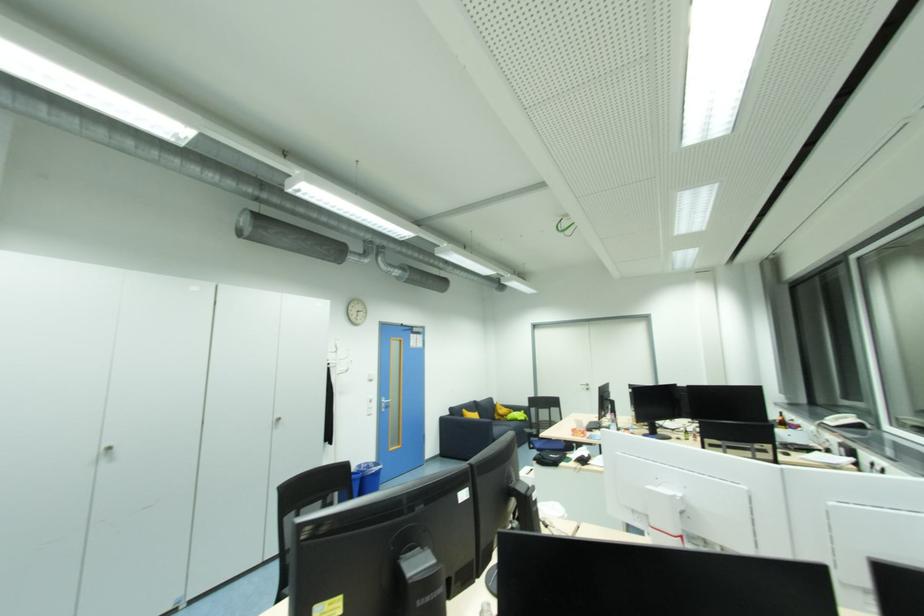
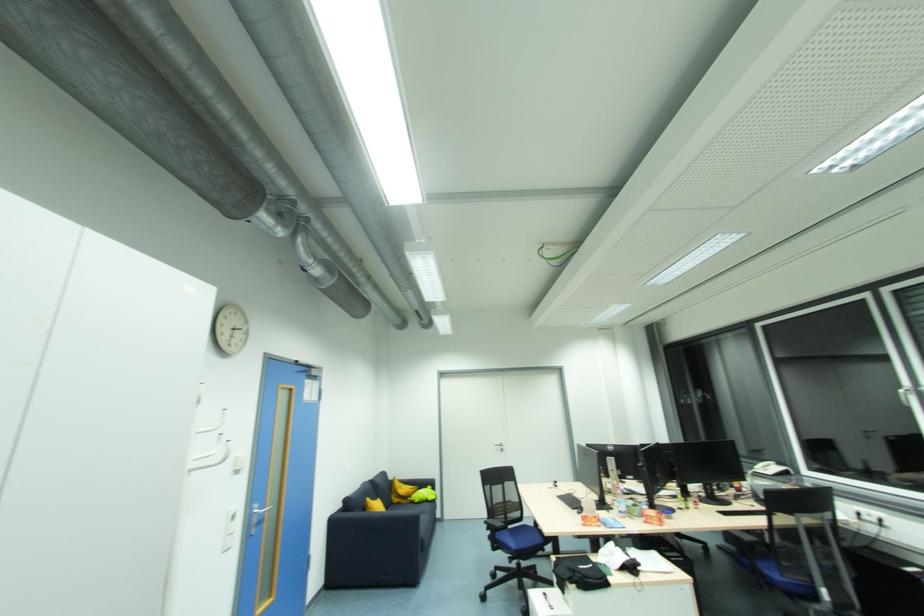
Find the pixel in the second image that matches point 388,403 in the first image.

(261, 517)